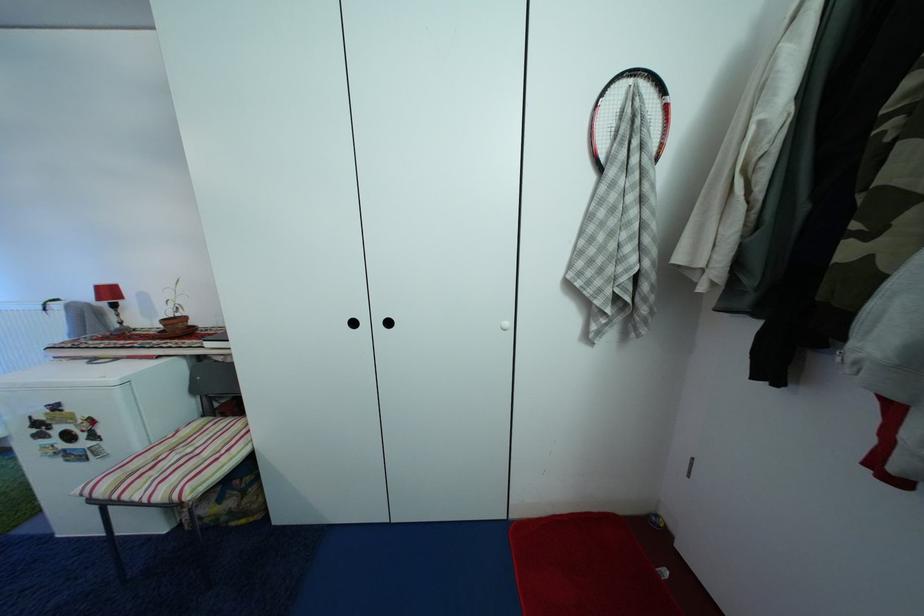
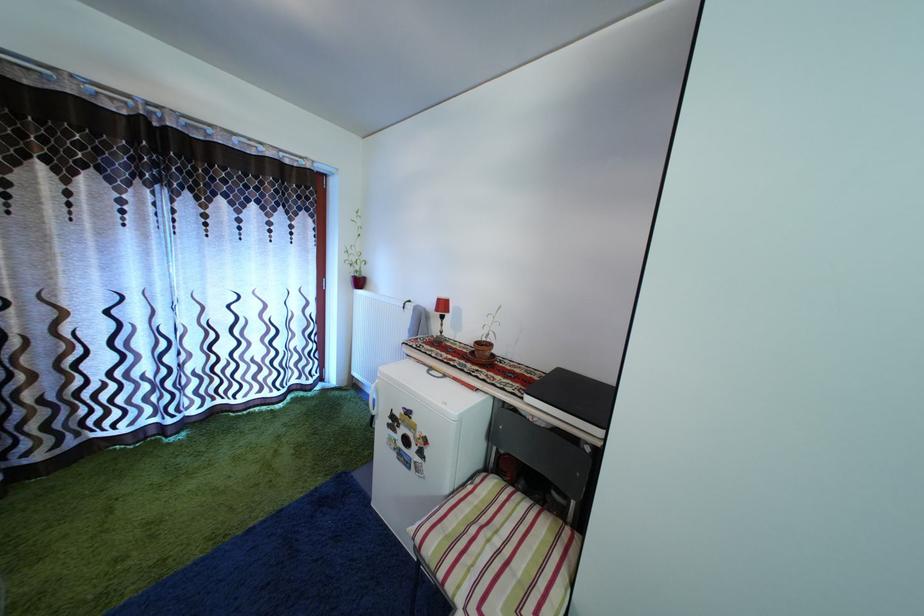
Question: The first image is from the beginning of the video and the second image is from the end. How did the camera likely rotate when shooting the video?

Choices:
 (A) Left
 (B) Right
 (C) Up
 (D) Down

Answer: (A)